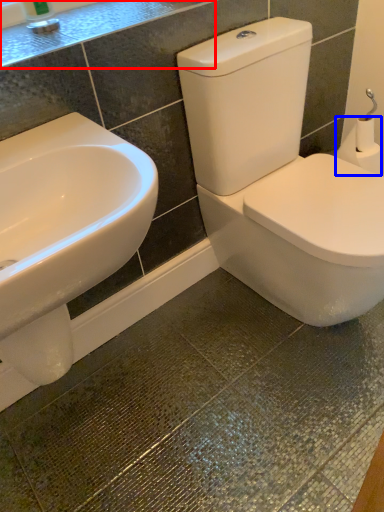
Question: Which object is further to the camera taking this photo, counter top (highlighted by a red box) or toilet paper (highlighted by a blue box)?

Choices:
 (A) counter top
 (B) toilet paper

Answer: (B)